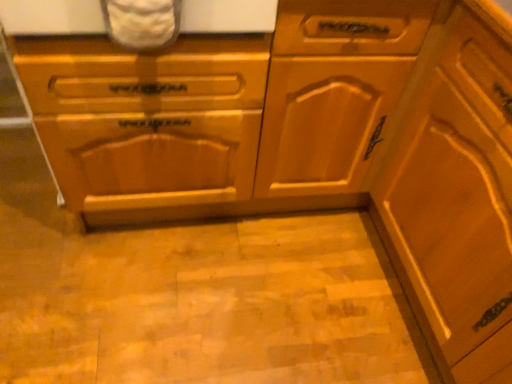
The width and height of the screenshot is (512, 384). Describe the element at coordinates (457, 196) in the screenshot. I see `wooden cabinet at right` at that location.

Find the location of a particular element. The image size is (512, 384). wooden cabinet at right is located at coordinates (457, 196).

I want to click on wooden cabinet at right, so click(x=457, y=196).